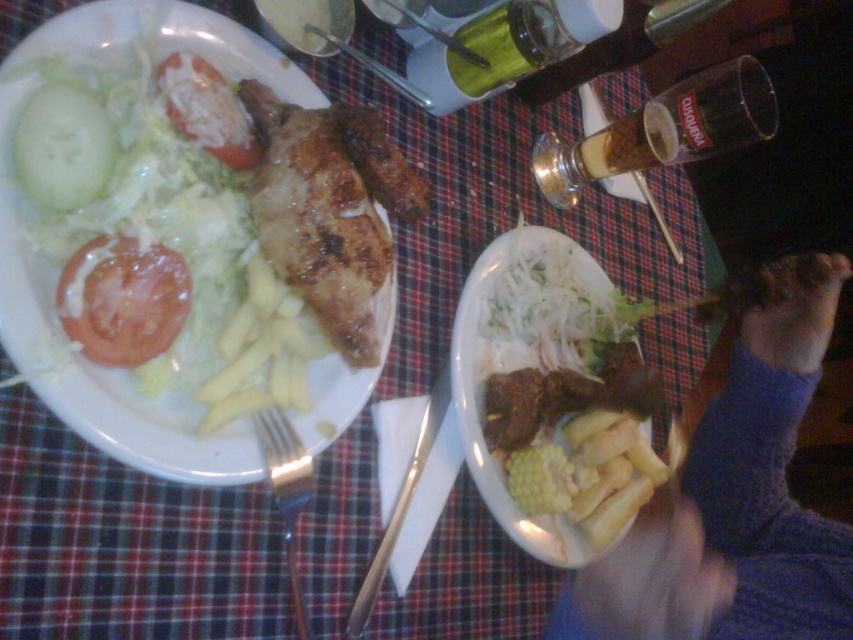
Question: Which of the following is the closest to the observer?

Choices:
 (A) (660, 225)
 (B) (654, 513)

Answer: (B)

Question: Based on their relative distances, which object is nearer to the blue knitted sweater at lower right?

Choices:
 (A) metallic spoon at upper center
 (B) green matte cucumber at left
 (C) brown crispy chicken at center

Answer: (C)

Question: Which point is closer to the camera?

Choices:
 (A) (637, 172)
 (B) (519, 545)
 (C) (305, 490)
 (D) (277, 202)

Answer: (D)

Question: Can you confirm if green matte cucumber at left is wider than brushed metal fork at upper center?

Choices:
 (A) yes
 (B) no

Answer: (B)

Question: Is brown crispy chicken at center wider than green matte cucumber at left?

Choices:
 (A) yes
 (B) no

Answer: (A)

Question: Does red matte tomato at left appear on the right side of green matte cucumber at left?

Choices:
 (A) yes
 (B) no

Answer: (A)